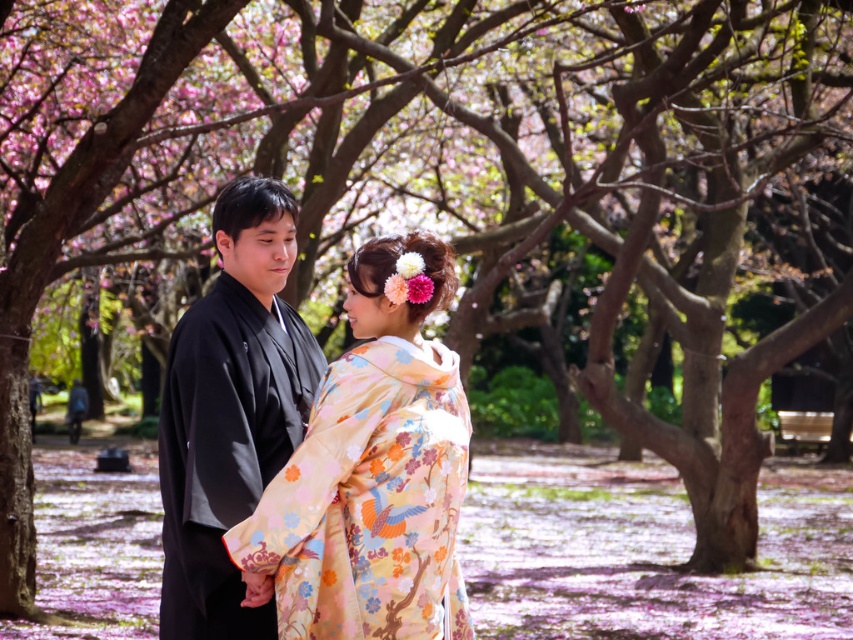
Question: Among these objects, which one is nearest to the camera?

Choices:
 (A) floral silk kimono at center
 (B) black silk kimono at center

Answer: (A)

Question: Is the position of floral silk kimono at center more distant than that of black silk kimono at center?

Choices:
 (A) yes
 (B) no

Answer: (B)

Question: Which of the following is the closest to the observer?

Choices:
 (A) black silk kimono at center
 (B) floral silk kimono at center

Answer: (B)

Question: Is floral silk kimono at center above black silk kimono at center?

Choices:
 (A) no
 (B) yes

Answer: (A)

Question: Is floral silk kimono at center thinner than black silk kimono at center?

Choices:
 (A) yes
 (B) no

Answer: (B)